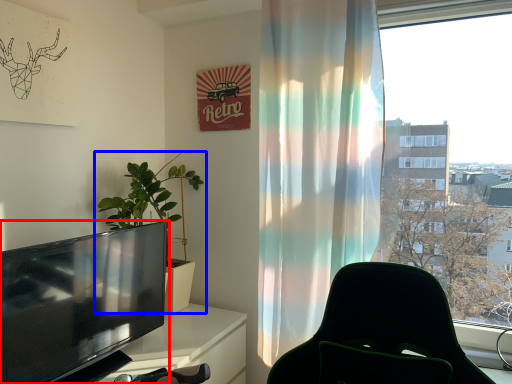
Question: Which point is closer to the camera, television (highlighted by a red box) or houseplant (highlighted by a blue box)?

Choices:
 (A) television
 (B) houseplant

Answer: (A)